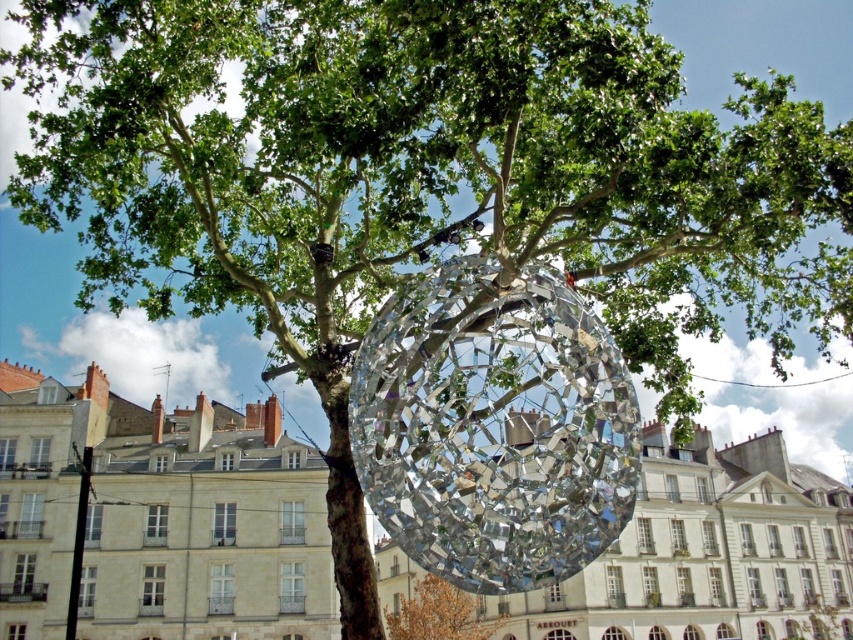
Question: Among these objects, which one is nearest to the camera?

Choices:
 (A) shiny metallic sphere at center
 (B) shiny metallic disco ball at center

Answer: (B)

Question: Is clear glass sphere at center wider than shiny metallic sphere at center?

Choices:
 (A) no
 (B) yes

Answer: (B)

Question: Is clear glass sphere at center thinner than shiny metallic sphere at center?

Choices:
 (A) yes
 (B) no

Answer: (B)

Question: Which object is the closest to the shiny metallic disco ball at center?

Choices:
 (A) clear glass sphere at center
 (B) shiny metallic sphere at center

Answer: (B)

Question: Which point is closer to the camera?

Choices:
 (A) (445, 310)
 (B) (154, 547)

Answer: (A)

Question: Does clear glass sphere at center have a lesser width compared to shiny metallic disco ball at center?

Choices:
 (A) no
 (B) yes

Answer: (A)